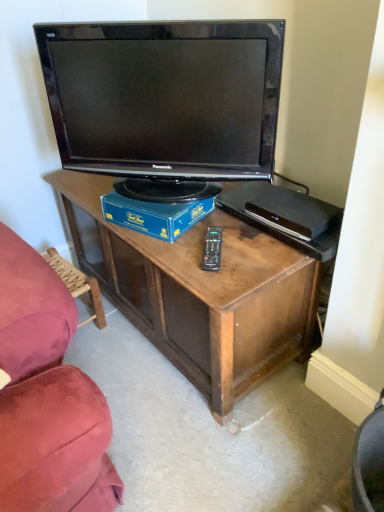
Question: Can you confirm if matte black television at center is positioned to the left of wooden swivel chair at lower left?

Choices:
 (A) no
 (B) yes

Answer: (A)

Question: From a real-world perspective, is matte black television at center located higher than wooden swivel chair at lower left?

Choices:
 (A) no
 (B) yes

Answer: (B)

Question: Is the depth of matte black television at center greater than that of wooden swivel chair at lower left?

Choices:
 (A) no
 (B) yes

Answer: (A)

Question: Is there a large distance between matte black television at center and wooden swivel chair at lower left?

Choices:
 (A) no
 (B) yes

Answer: (A)

Question: From a real-world perspective, is matte black television at center below wooden swivel chair at lower left?

Choices:
 (A) yes
 (B) no

Answer: (B)

Question: From a real-world perspective, is black plastic remote at center physically located above or below blue cardboard box at center?

Choices:
 (A) below
 (B) above

Answer: (A)

Question: Is black plastic remote at center to the left or to the right of blue cardboard box at center in the image?

Choices:
 (A) left
 (B) right

Answer: (B)

Question: In terms of size, does black plastic remote at center appear bigger or smaller than blue cardboard box at center?

Choices:
 (A) big
 (B) small

Answer: (B)

Question: Is black plastic remote at center wider or thinner than blue cardboard box at center?

Choices:
 (A) thin
 (B) wide

Answer: (A)

Question: From a real-world perspective, is blue cardboard box at center physically located above or below matte black television at center?

Choices:
 (A) below
 (B) above

Answer: (A)

Question: Is blue cardboard box at center wider or thinner than matte black television at center?

Choices:
 (A) wide
 (B) thin

Answer: (A)

Question: Is blue cardboard box at center to the left or to the right of matte black television at center in the image?

Choices:
 (A) left
 (B) right

Answer: (B)

Question: Considering the positions of blue cardboard box at center and matte black television at center in the image, is blue cardboard box at center taller or shorter than matte black television at center?

Choices:
 (A) short
 (B) tall

Answer: (A)

Question: In terms of height, does wooden swivel chair at lower left look taller or shorter compared to black plastic remote at center?

Choices:
 (A) short
 (B) tall

Answer: (B)

Question: Relative to black plastic remote at center, is wooden swivel chair at lower left in front or behind?

Choices:
 (A) behind
 (B) front

Answer: (A)